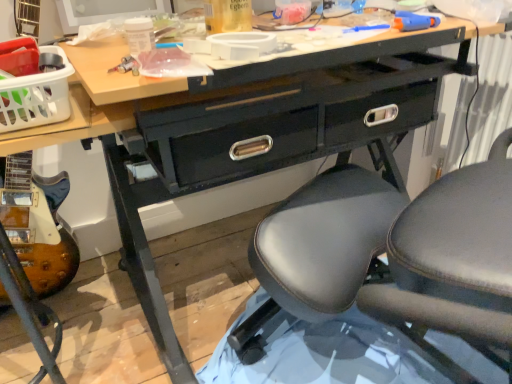
Question: From their relative heights in the image, would you say black leather chair at center is taller or shorter than wooden electric guitar at lower left?

Choices:
 (A) short
 (B) tall

Answer: (B)

Question: In terms of width, does black leather chair at center look wider or thinner when compared to wooden electric guitar at lower left?

Choices:
 (A) thin
 (B) wide

Answer: (B)

Question: Based on their relative distances, which object is farther from the white plastic basket at upper left?

Choices:
 (A) black leather chair at center
 (B) wooden electric guitar at lower left

Answer: (A)

Question: Which is farther from the black leather chair at center?

Choices:
 (A) white plastic basket at upper left
 (B) wooden electric guitar at lower left

Answer: (B)